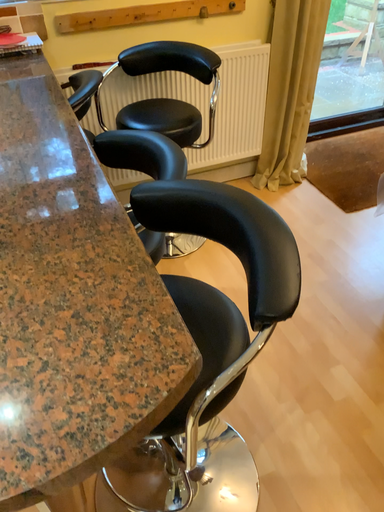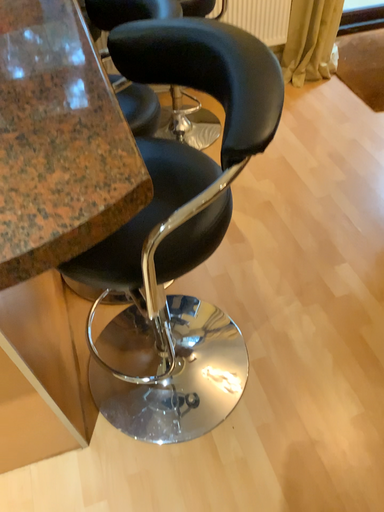
Question: How did the camera likely rotate when shooting the video?

Choices:
 (A) rotated upward
 (B) rotated downward

Answer: (B)